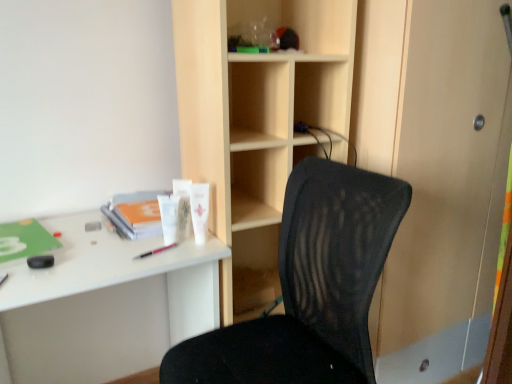
Question: Considering the positions of point (158, 331) and point (198, 215), is point (158, 331) closer or farther from the camera than point (198, 215)?

Choices:
 (A) closer
 (B) farther

Answer: (B)

Question: From the image's perspective, is white plastic desk at left located above or below white matte lotion at center, the first stationery positioned from the right?

Choices:
 (A) above
 (B) below

Answer: (B)

Question: Which object is the farthest from the white plastic desk at left?

Choices:
 (A) transparent glass screen door at right
 (B) black mesh chair at center
 (C) pink plastic pen at center, the second stationery in the top-to-bottom sequence
 (D) white matte lotion at center, the first stationery positioned from the right
 (E) wooden at center

Answer: (A)

Question: Estimate the real-world distances between objects in this image. Which object is closer to the white matte lotion at center, arranged as the 2th stationery when ordered from the bottom?

Choices:
 (A) white plastic desk at left
 (B) wooden at center
 (C) black mesh chair at center
 (D) pink plastic pen at center, acting as the first stationery starting from the left
 (E) transparent glass screen door at right

Answer: (D)